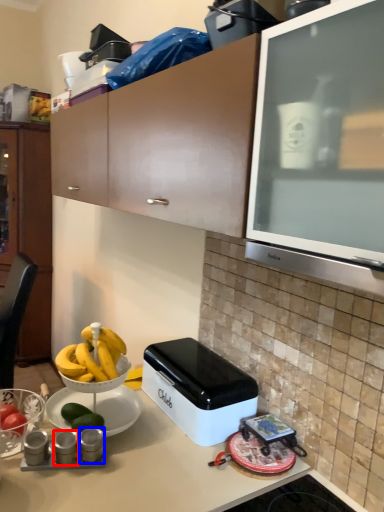
Question: Which point is closer to the camera, appliance (highlighted by a red box) or appliance (highlighted by a blue box)?

Choices:
 (A) appliance
 (B) appliance

Answer: (B)